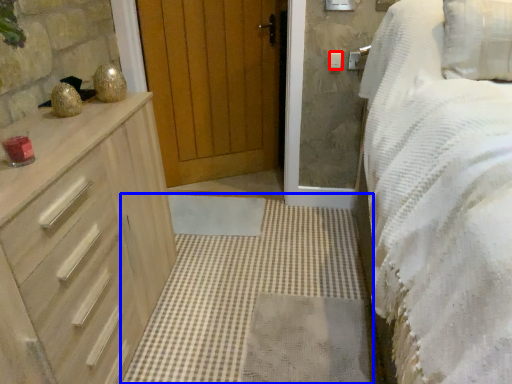
Question: Which of the following is the farthest to the observer, light switch (highlighted by a red box) or plain (highlighted by a blue box)?

Choices:
 (A) light switch
 (B) plain

Answer: (A)